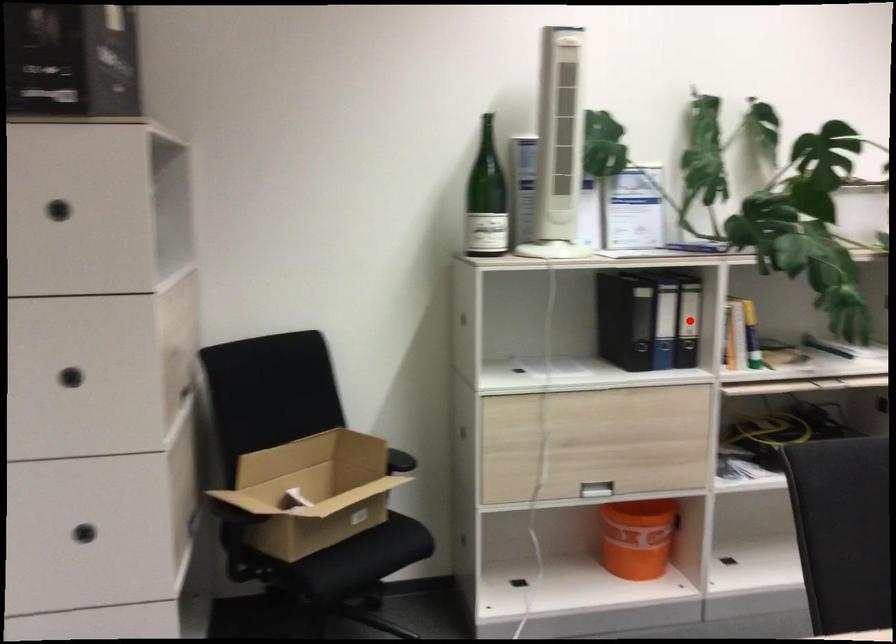
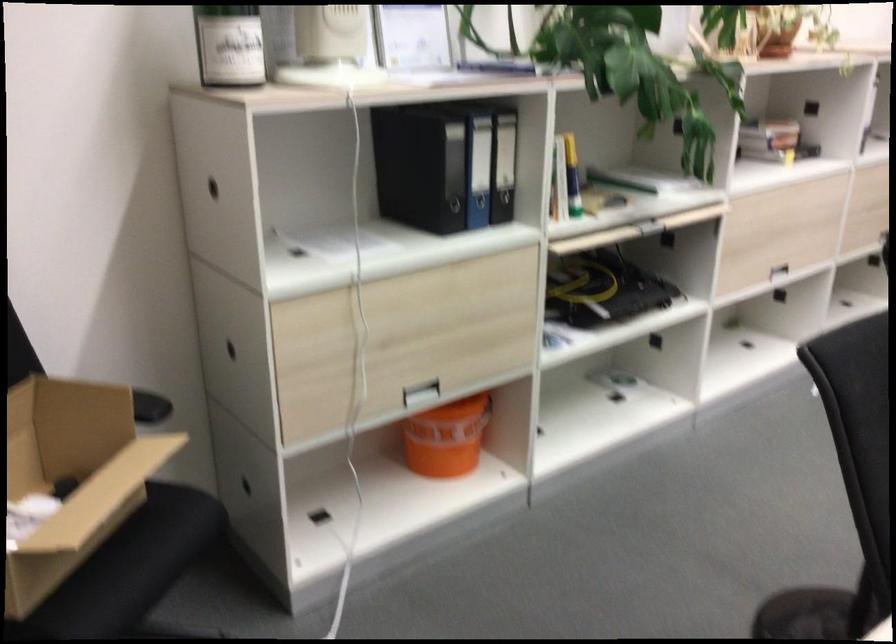
Question: A red point is marked in image1. In image2, is the corresponding 3D point closer to the camera or farther? Reply with the corresponding letter.

Choices:
 (A) The corresponding 3D point is closer.
 (B) The corresponding 3D point is farther.

Answer: (A)